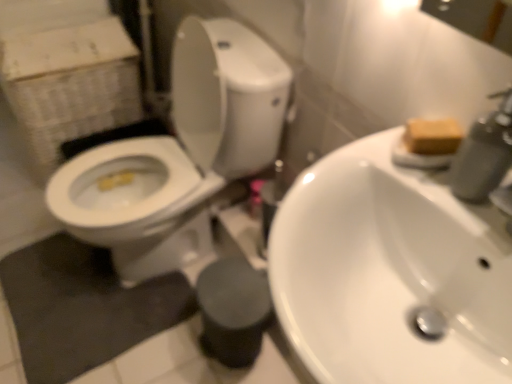
Question: Can you confirm if brown matte soap at upper right is shorter than white glossy sink at center?

Choices:
 (A) yes
 (B) no

Answer: (A)

Question: Is brown matte soap at upper right positioned beyond the bounds of white glossy sink at center?

Choices:
 (A) yes
 (B) no

Answer: (A)

Question: Is brown matte soap at upper right closer to camera compared to white glossy sink at center?

Choices:
 (A) yes
 (B) no

Answer: (B)

Question: From the image's perspective, is brown matte soap at upper right above white glossy sink at center?

Choices:
 (A) yes
 (B) no

Answer: (A)

Question: From the image's perspective, is brown matte soap at upper right beneath white glossy sink at center?

Choices:
 (A) no
 (B) yes

Answer: (A)

Question: Looking at their shapes, would you say matte gray soap dispenser at upper right is wider or thinner than white cardboard box at left?

Choices:
 (A) thin
 (B) wide

Answer: (A)

Question: From a real-world perspective, is matte gray soap dispenser at upper right positioned above or below white cardboard box at left?

Choices:
 (A) below
 (B) above

Answer: (B)

Question: Is matte gray soap dispenser at upper right inside or outside of white cardboard box at left?

Choices:
 (A) inside
 (B) outside

Answer: (B)

Question: Is matte gray soap dispenser at upper right taller or shorter than white cardboard box at left?

Choices:
 (A) tall
 (B) short

Answer: (B)

Question: Is white cardboard box at left to the left or to the right of black rubber bath mat at lower left in the image?

Choices:
 (A) left
 (B) right

Answer: (A)

Question: Looking at their shapes, would you say white cardboard box at left is wider or thinner than black rubber bath mat at lower left?

Choices:
 (A) wide
 (B) thin

Answer: (B)

Question: From a real-world perspective, is white cardboard box at left above or below black rubber bath mat at lower left?

Choices:
 (A) above
 (B) below

Answer: (A)

Question: From the image's perspective, is white cardboard box at left located above or below black rubber bath mat at lower left?

Choices:
 (A) below
 (B) above

Answer: (B)

Question: Looking at their shapes, would you say white glossy sink at center is wider or thinner than white glossy toilet at left?

Choices:
 (A) thin
 (B) wide

Answer: (A)

Question: Does point (465, 352) appear closer or farther from the camera than point (249, 109)?

Choices:
 (A) closer
 (B) farther

Answer: (A)